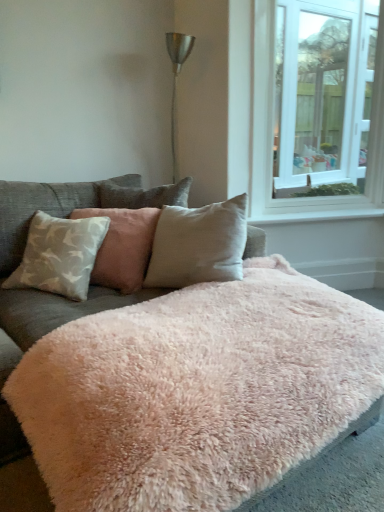
Question: Relative to white smooth window sill at upper right, is white glass window at upper right in front or behind?

Choices:
 (A) behind
 (B) front

Answer: (B)

Question: Looking at the image, does white glass window at upper right seem bigger or smaller compared to white smooth window sill at upper right?

Choices:
 (A) big
 (B) small

Answer: (A)

Question: Which object is positioned farthest from the white glass window at upper right?

Choices:
 (A) light gray fabric pillow at left, which ranks as the second pillow in right-to-left order
 (B) light beige fabric pillow at center, marked as the 1th pillow in a right-to-left arrangement
 (C) white smooth window sill at upper right
 (D) fluffy pink blanket at center

Answer: (D)

Question: Based on their relative distances, which object is farther from the fluffy pink blanket at center?

Choices:
 (A) white smooth window sill at upper right
 (B) light gray fabric pillow at left, which ranks as the second pillow in right-to-left order
 (C) light beige fabric pillow at center, marked as the 1th pillow in a right-to-left arrangement
 (D) white glass window at upper right

Answer: (D)